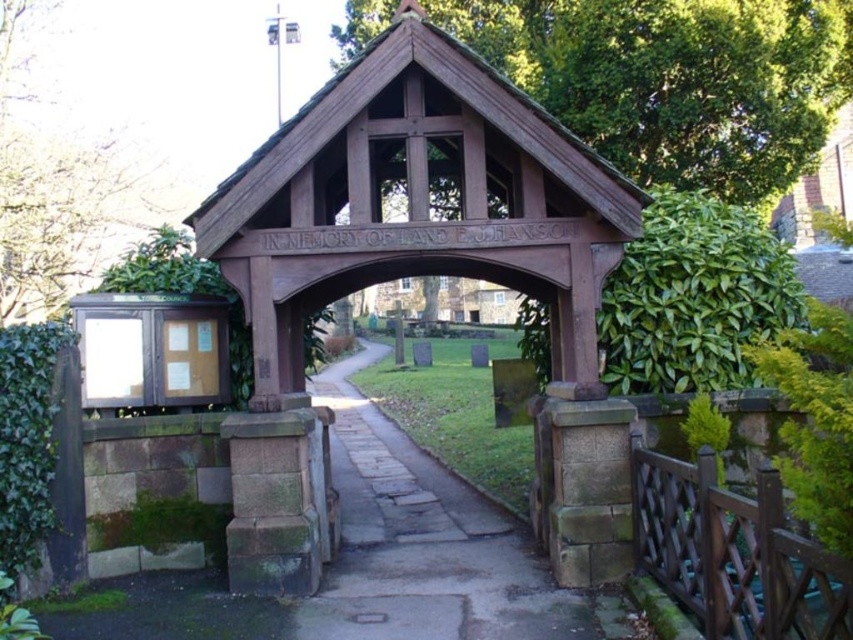
Between point (267, 420) and point (53, 282), which one is positioned behind?

Point (53, 282)

Is point (288, 444) in front of point (22, 308)?

Yes, it is.

Where is `wooden gazebo at center`? The height and width of the screenshot is (640, 853). wooden gazebo at center is located at coordinates (422, 275).

Who is more distant from viewer, (712, 100) or (15, 182)?

Positioned behind is point (15, 182).

Looking at this image, can you confirm if green leafy tree at upper center is wider than green leafy tree at upper left?

Yes, green leafy tree at upper center is wider than green leafy tree at upper left.

You are a GUI agent. You are given a task and a screenshot of the screen. Output one action in this format:
    pyautogui.click(x=<x>, y=<y>)
    Task: Click on the green leafy tree at upper center
    
    Given the screenshot: What is the action you would take?
    pyautogui.click(x=676, y=81)

In the scene shown: Does wooden gazebo at center have a greater height compared to paved stone path at center?

Yes.

The image size is (853, 640). Describe the element at coordinates (422, 275) in the screenshot. I see `wooden gazebo at center` at that location.

Who is more distant from viewer, (602,163) or (392,563)?

→ The point (392,563) is more distant.

This screenshot has height=640, width=853. In order to click on wooden gazebo at center in this screenshot , I will do `click(422, 275)`.